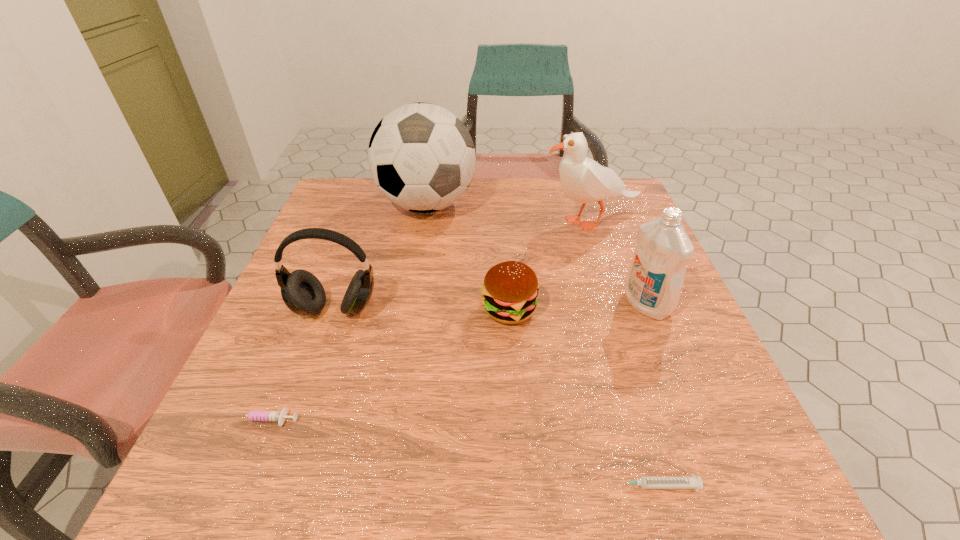
You are a GUI agent. You are given a task and a screenshot of the screen. Output one action in this format:
    pyautogui.click(x=<x>, y=<y>)
    Task: Click on the free region located 0.390m at the needle end of the nearest object
    
    Given the screenshot: What is the action you would take?
    [x=348, y=485]

At what (x,y) coordinates should I click in order to perform the action: click on soccer ball at the far edge. Please return your answer as a coordinate pair (x, y). The image size is (960, 540). Looking at the image, I should click on (421, 157).

The width and height of the screenshot is (960, 540). I want to click on gull at the far edge, so [x=583, y=180].

At what (x,y) coordinates should I click in order to perform the action: click on object that is at the near edge. Please return your answer as a coordinate pair (x, y). Looking at the image, I should click on (692, 482).

What are the coordinates of `soccer ball that is positioned at the left edge` in the screenshot? It's located at (421, 157).

What are the coordinates of `headset at the left edge` in the screenshot? It's located at (302, 292).

In order to click on syringe at the left edge in this screenshot , I will do `click(254, 415)`.

Where is `gull positioned at the right edge`? gull positioned at the right edge is located at coordinates (583, 180).

Locate an element on the screen. The height and width of the screenshot is (540, 960). detergent present at the right edge is located at coordinates (654, 281).

I want to click on syringe located at the right edge, so click(692, 482).